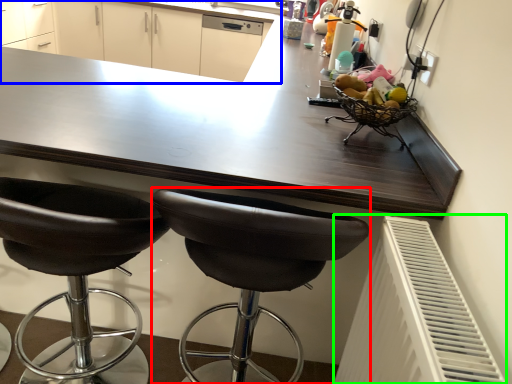
Question: Considering the real-world distances, which object is farthest from chair (highlighted by a red box)? cabinetry (highlighted by a blue box) or radiator (highlighted by a green box)?

Choices:
 (A) cabinetry
 (B) radiator

Answer: (A)